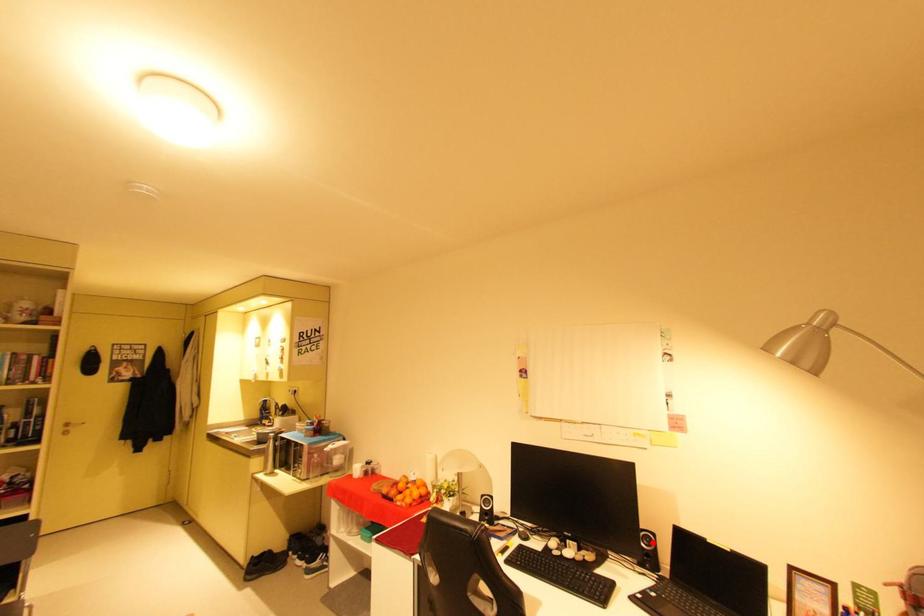
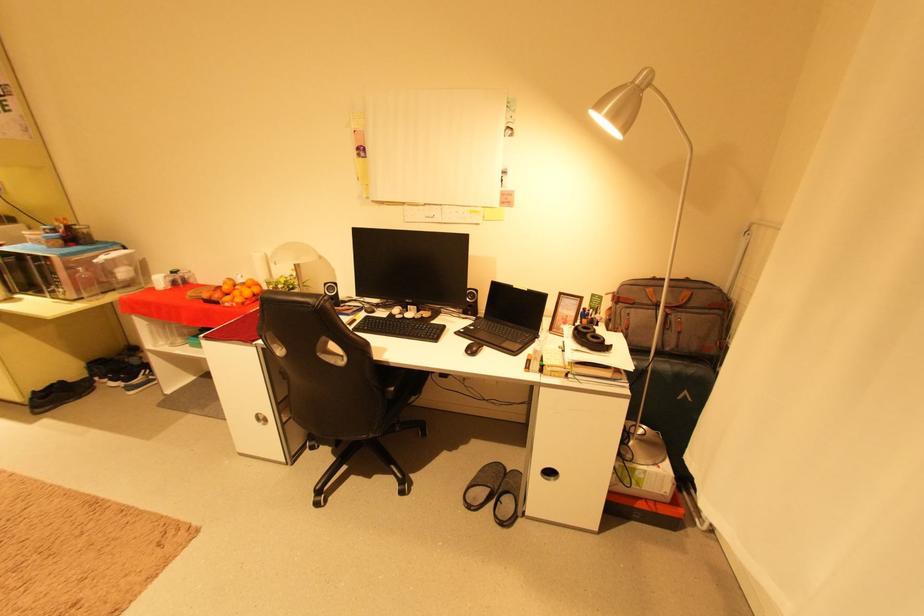
Where in the second image is the point corresponding to the highlighted location from the first image?

(477, 298)